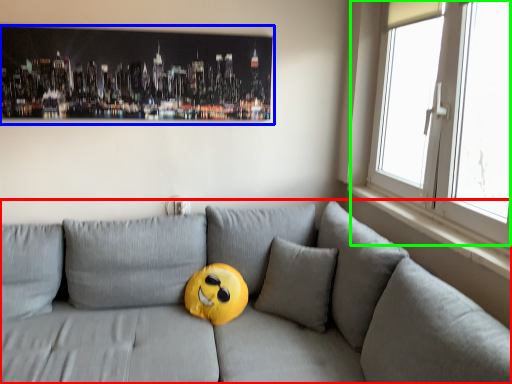
Question: Based on their relative distances, which object is farther from studio couch (highlighted by a red box)? Choose from picture frame (highlighted by a blue box) and window (highlighted by a green box).

Choices:
 (A) picture frame
 (B) window

Answer: (A)